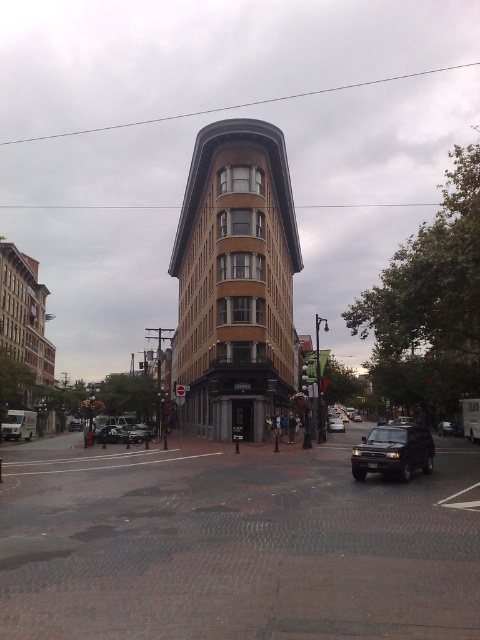
Can you confirm if brick pavement at center is shorter than shiny black suv at lower right?

Indeed, brick pavement at center has a lesser height compared to shiny black suv at lower right.

Is point (11, 609) behind point (428, 465)?

No, it is not.

Between point (347, 480) and point (433, 456), which one is positioned behind?

Point (433, 456)

The image size is (480, 640). What are the coordinates of `brick pavement at center` in the screenshot? It's located at (235, 544).

In the scene shown: Can you confirm if brick pavement at center is positioned above shiny silver sedan at lower left?

Correct, brick pavement at center is located above shiny silver sedan at lower left.

Identify the location of brick pavement at center. This screenshot has height=640, width=480. (235, 544).

In order to click on brick pavement at center in this screenshot , I will do `click(235, 544)`.

Measure the distance from shiny black suv at lower right to shiny silver sedan at lower left.

shiny black suv at lower right and shiny silver sedan at lower left are 19.80 meters apart.

Can you confirm if shiny black suv at lower right is smaller than shiny silver sedan at lower left?

Incorrect, shiny black suv at lower right is not smaller in size than shiny silver sedan at lower left.

Which is behind, point (404, 432) or point (108, 429)?

The point (108, 429) is behind.

Identify the location of shiny black suv at lower right. (394, 451).